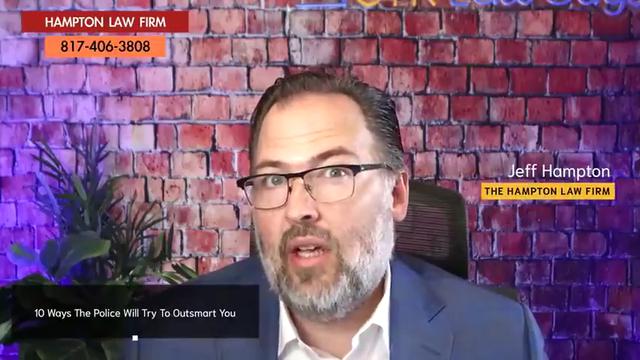
Locate an element on the screen. The height and width of the screenshot is (360, 640). seatback of chair is located at coordinates (432, 229).